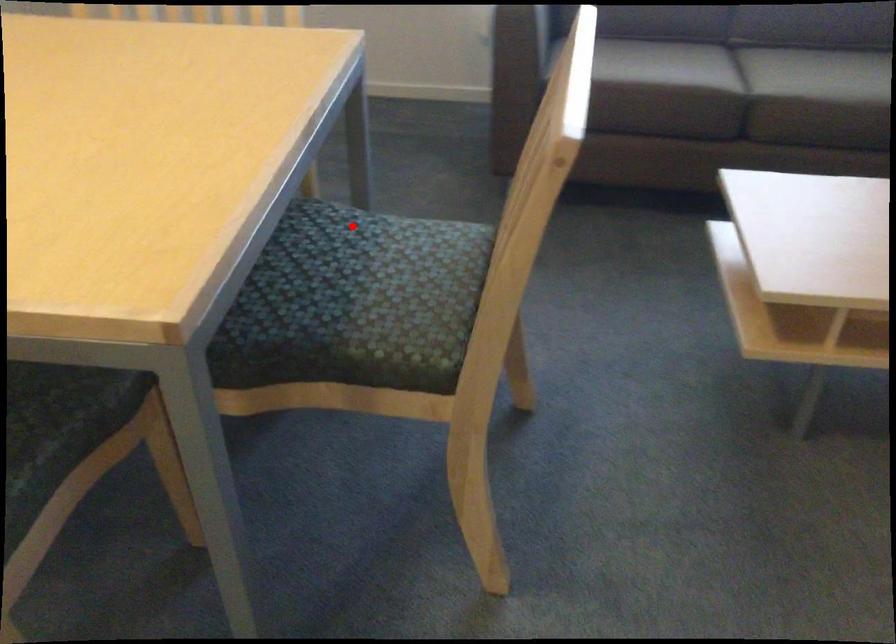
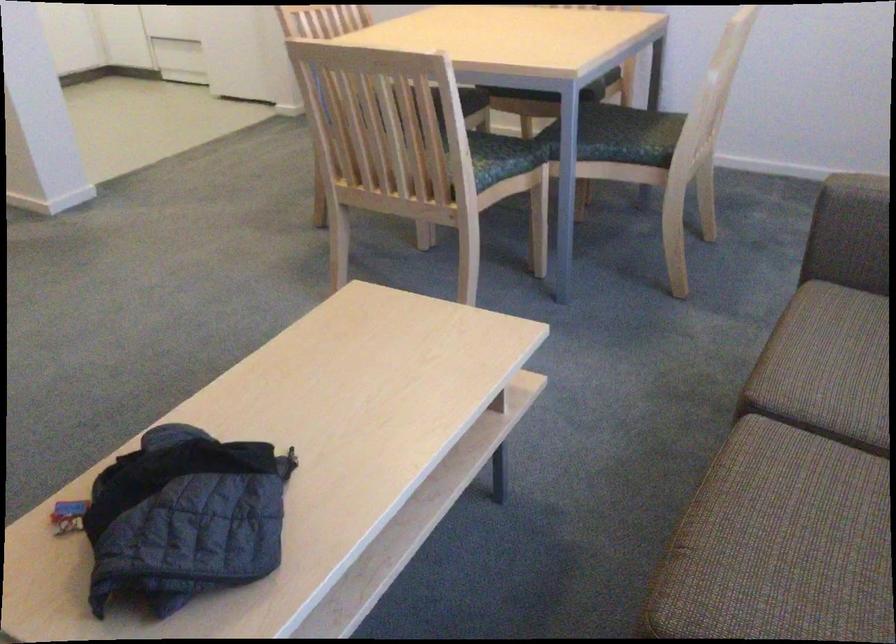
Question: I am providing you with two images of the same scene from different viewpoints. Image1 has a red point marked. In image2, the corresponding 3D location appears at what relative position? Reply with the corresponding letter.

Choices:
 (A) Closer
 (B) Farther

Answer: (B)